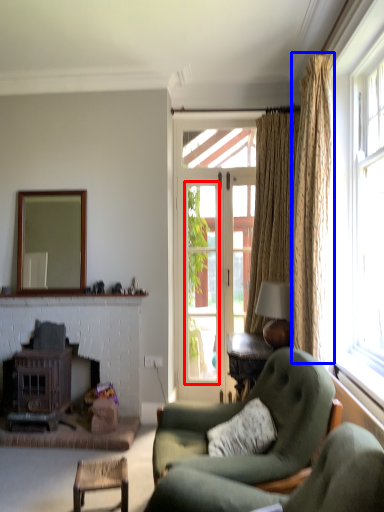
Question: Among these objects, which one is farthest to the camera, window screen (highlighted by a red box) or curtain (highlighted by a blue box)?

Choices:
 (A) window screen
 (B) curtain

Answer: (A)